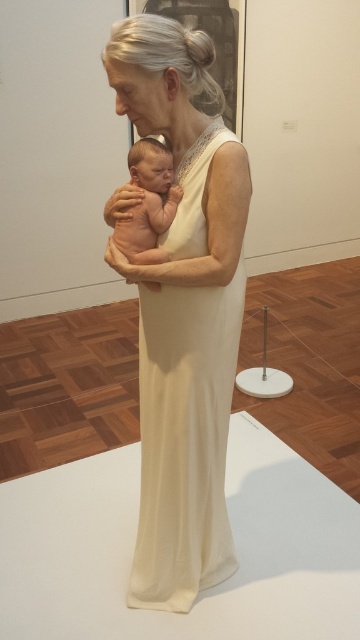
Can you confirm if white silk dress at center is positioned above smooth skin baby at center?

No.

Is white silk dress at center in front of smooth skin baby at center?

Yes, white silk dress at center is closer to the viewer.

Where is `white silk dress at center`? This screenshot has height=640, width=360. white silk dress at center is located at coordinates (185, 440).